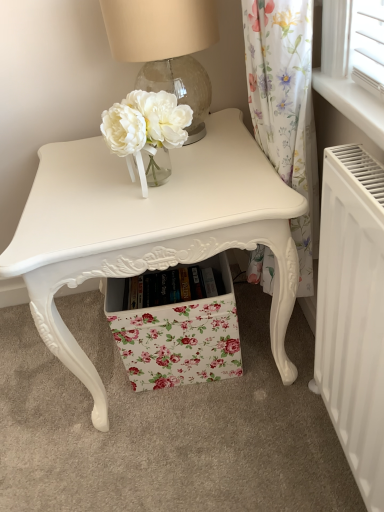
Measure the distance between white matte radiator at lower right and camera.

The distance of white matte radiator at lower right from camera is 51.37 centimeters.

What is the approximate width of white matte radiator at lower right?

The width of white matte radiator at lower right is 3.24 inches.

Where is `translucent glass table lamp at upper center`? Image resolution: width=384 pixels, height=512 pixels. translucent glass table lamp at upper center is located at coordinates (166, 48).

The width and height of the screenshot is (384, 512). Find the location of `matte white table at center`. matte white table at center is located at coordinates [150, 229].

This screenshot has width=384, height=512. Find the location of `white matte radiator at lower right`. white matte radiator at lower right is located at coordinates (353, 312).

From a real-world perspective, which object rests below the other?

From a 3D spatial view, floral fabric drawer at center is below.

Which is nearer, (x=339, y=272) or (x=221, y=347)?

Point (x=339, y=272)

Considering the relative sizes of white matte radiator at lower right and floral fabric drawer at center in the image provided, is white matte radiator at lower right taller than floral fabric drawer at center?

A: Correct, white matte radiator at lower right is much taller as floral fabric drawer at center.

Considering the positions of objects white matte radiator at lower right and floral fabric drawer at center in the image provided, who is more to the left, white matte radiator at lower right or floral fabric drawer at center?

Positioned to the left is floral fabric drawer at center.

From the image's perspective, which is below, matte white table at center or floral fabric drawer at center?

floral fabric drawer at center.

How much distance is there between matte white table at center and floral fabric drawer at center?

A distance of 9.21 inches exists between matte white table at center and floral fabric drawer at center.

Is matte white table at center aimed at floral fabric drawer at center?

Yes.

Which point is more forward, (71, 336) or (213, 297)?

The point (71, 336) is in front.

From the image's perspective, which is above, floral fabric drawer at center or translucent glass table lamp at upper center?

translucent glass table lamp at upper center appears higher in the image.

Which object is positioned more to the right, floral fabric drawer at center or translucent glass table lamp at upper center?

From the viewer's perspective, floral fabric drawer at center appears more on the right side.

Is floral fabric drawer at center taller or shorter than translucent glass table lamp at upper center?

Clearly, floral fabric drawer at center is shorter compared to translucent glass table lamp at upper center.

Is floral fabric drawer at center bigger or smaller than translucent glass table lamp at upper center?

Considering their sizes, floral fabric drawer at center takes up more space than translucent glass table lamp at upper center.

From the image's perspective, is floral fabric drawer at center on top of white matte radiator at lower right?

Yes, from the image's perspective, floral fabric drawer at center is on top of white matte radiator at lower right.

In terms of height, does floral fabric drawer at center look taller or shorter compared to white matte radiator at lower right?

floral fabric drawer at center is shorter than white matte radiator at lower right.

Which is behind, point (208, 374) or point (357, 249)?

The point (208, 374) is farther from the camera.

From a real-world perspective, is translucent glass table lamp at upper center under white matte radiator at lower right?

No.

From the picture: Which object is wider, translucent glass table lamp at upper center or white matte radiator at lower right?

Wider between the two is translucent glass table lamp at upper center.

Locate an element on the screen. The height and width of the screenshot is (512, 384). table lamp that appears above the white matte radiator at lower right (from the image's perspective) is located at coordinates (166, 48).

Measure the distance between translucent glass table lamp at upper center and white matte radiator at lower right.

translucent glass table lamp at upper center and white matte radiator at lower right are 59.07 centimeters apart.

Between floral fabric drawer at center and matte white table at center, which one has smaller width?

floral fabric drawer at center is thinner.

From the image's perspective, does floral fabric drawer at center appear higher than matte white table at center?

Incorrect, from the image's perspective, floral fabric drawer at center is lower than matte white table at center.

Locate an element on the screen. The height and width of the screenshot is (512, 384). drawer on the right of matte white table at center is located at coordinates (178, 336).

Does floral fabric drawer at center turn towards matte white table at center?

Yes.

Is translucent glass table lamp at upper center oriented towards floral fabric drawer at center?

No, translucent glass table lamp at upper center is not oriented towards floral fabric drawer at center.

Considering the relative sizes of translucent glass table lamp at upper center and floral fabric drawer at center in the image provided, is translucent glass table lamp at upper center wider than floral fabric drawer at center?

No.

Is the position of translucent glass table lamp at upper center more distant than that of floral fabric drawer at center?

No, the depth of translucent glass table lamp at upper center is less than that of floral fabric drawer at center.

In the scene shown: Measure the distance between translucent glass table lamp at upper center and floral fabric drawer at center.

They are 22.15 inches apart.

Locate an element on the screen. This screenshot has height=512, width=384. radiator on the right of floral fabric drawer at center is located at coordinates (353, 312).

The height and width of the screenshot is (512, 384). In order to click on drawer behind the matte white table at center in this screenshot , I will do `click(178, 336)`.

Which object lies nearer to the anchor point translucent glass table lamp at upper center, floral fabric drawer at center or matte white table at center?

Among the two, matte white table at center is located nearer to translucent glass table lamp at upper center.

When comparing their distances from white matte radiator at lower right, does matte white table at center or floral fabric drawer at center seem further?

floral fabric drawer at center is further to white matte radiator at lower right.

Looking at the image, which one is located closer to translucent glass table lamp at upper center, white matte radiator at lower right or floral fabric drawer at center?

The object closer to translucent glass table lamp at upper center is floral fabric drawer at center.

Consider the image. Based on their spatial positions, is floral fabric drawer at center or matte white table at center closer to white matte radiator at lower right?

Based on the image, matte white table at center appears to be nearer to white matte radiator at lower right.

Estimate the real-world distances between objects in this image. Which object is closer to matte white table at center, white matte radiator at lower right or translucent glass table lamp at upper center?

Based on the image, translucent glass table lamp at upper center appears to be nearer to matte white table at center.

In the scene shown: When comparing their distances from matte white table at center, does white matte radiator at lower right or floral fabric drawer at center seem further?

The object further to matte white table at center is white matte radiator at lower right.

Looking at the image, which one is located further to white matte radiator at lower right, matte white table at center or translucent glass table lamp at upper center?

translucent glass table lamp at upper center lies further to white matte radiator at lower right than the other object.

Considering their positions, is translucent glass table lamp at upper center positioned closer to floral fabric drawer at center than matte white table at center?

matte white table at center lies closer to floral fabric drawer at center than the other object.

Identify the location of table located between white matte radiator at lower right and floral fabric drawer at center in the depth direction. This screenshot has height=512, width=384. (150, 229).

Locate an element on the screen. drawer that lies between translucent glass table lamp at upper center and white matte radiator at lower right from top to bottom is located at coordinates (178, 336).

The image size is (384, 512). What are the coordinates of `table between translucent glass table lamp at upper center and floral fabric drawer at center in the up-down direction` in the screenshot? It's located at (150, 229).

The image size is (384, 512). I want to click on table that lies between translucent glass table lamp at upper center and white matte radiator at lower right from top to bottom, so click(x=150, y=229).